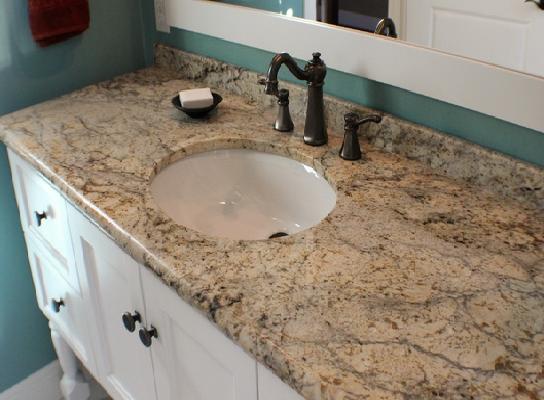
The image size is (544, 400). I want to click on cabinet, so click(136, 372).